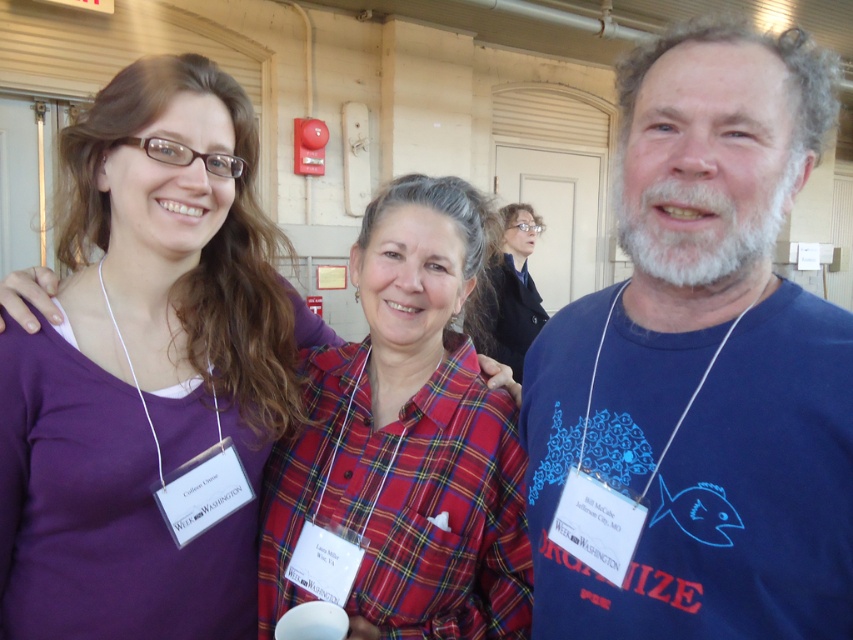
Question: Which object is positioned farthest from the blue cotton t-shirt at center?

Choices:
 (A) purple fabric shirt at upper left
 (B) plaid fabric shirt at center

Answer: (B)

Question: Which object is positioned closest to the blue cotton t-shirt at center?

Choices:
 (A) purple fabric shirt at upper left
 (B) plaid fabric shirt at center

Answer: (A)

Question: Is blue cotton t-shirt at center to the left of purple fabric shirt at upper left from the viewer's perspective?

Choices:
 (A) yes
 (B) no

Answer: (B)

Question: Which is nearer to the plaid fabric shirt at center?

Choices:
 (A) purple fabric shirt at upper left
 (B) blue cotton t-shirt at center

Answer: (A)

Question: Does purple fabric shirt at upper left appear under plaid fabric shirt at center?

Choices:
 (A) yes
 (B) no

Answer: (A)

Question: Where is blue cotton t-shirt at center located in relation to purple fabric shirt at upper left in the image?

Choices:
 (A) below
 (B) above

Answer: (B)